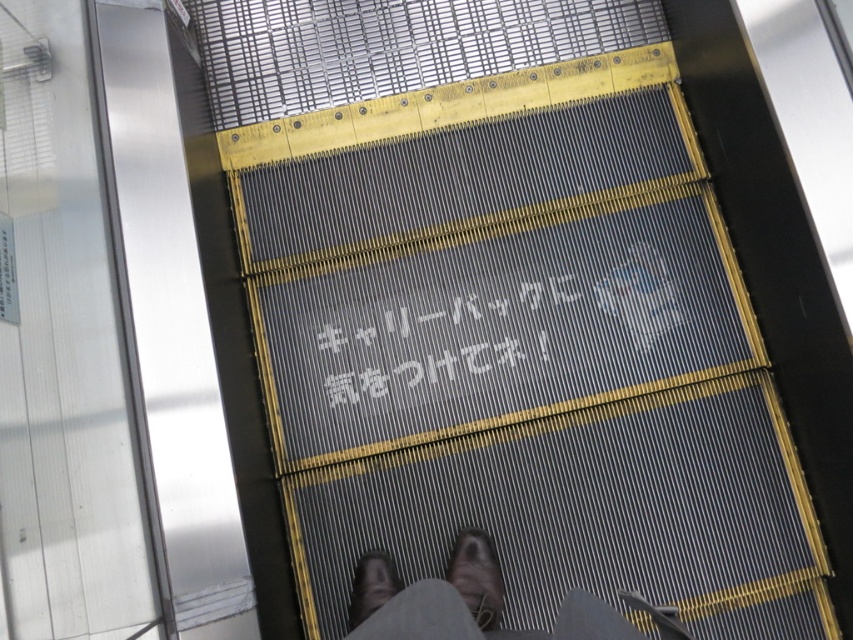
Question: Which point is farther to the camera?

Choices:
 (A) (387, 589)
 (B) (407, 365)
 (C) (498, 572)
 (D) (360, 614)

Answer: (B)

Question: Estimate the real-world distances between objects in this image. Which object is farther from the whitematerial/texturewriting at center?

Choices:
 (A) dark brown leather shoes at center
 (B) brown leather shoe at center

Answer: (A)

Question: Is whitematerial/texturewriting at center further to the viewer compared to dark brown leather shoe at lower center?

Choices:
 (A) no
 (B) yes

Answer: (B)

Question: Does whitematerial/texturewriting at center appear on the right side of dark brown leather shoe at lower center?

Choices:
 (A) no
 (B) yes

Answer: (B)

Question: Which object is farther from the camera taking this photo?

Choices:
 (A) dark brown leather shoes at center
 (B) brown leather shoe at center

Answer: (B)

Question: Can you confirm if dark brown leather shoes at center is positioned to the right of dark brown leather shoe at lower center?

Choices:
 (A) yes
 (B) no

Answer: (A)